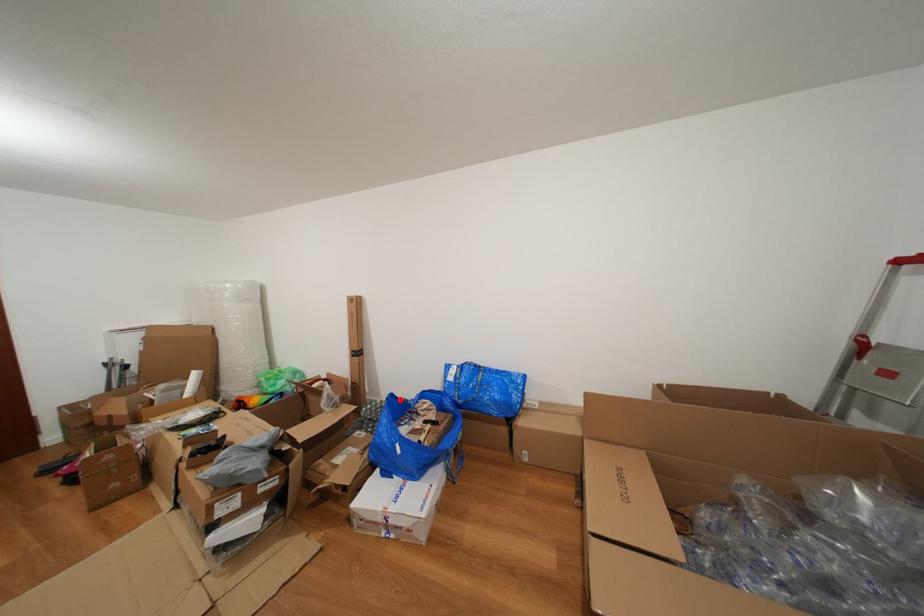
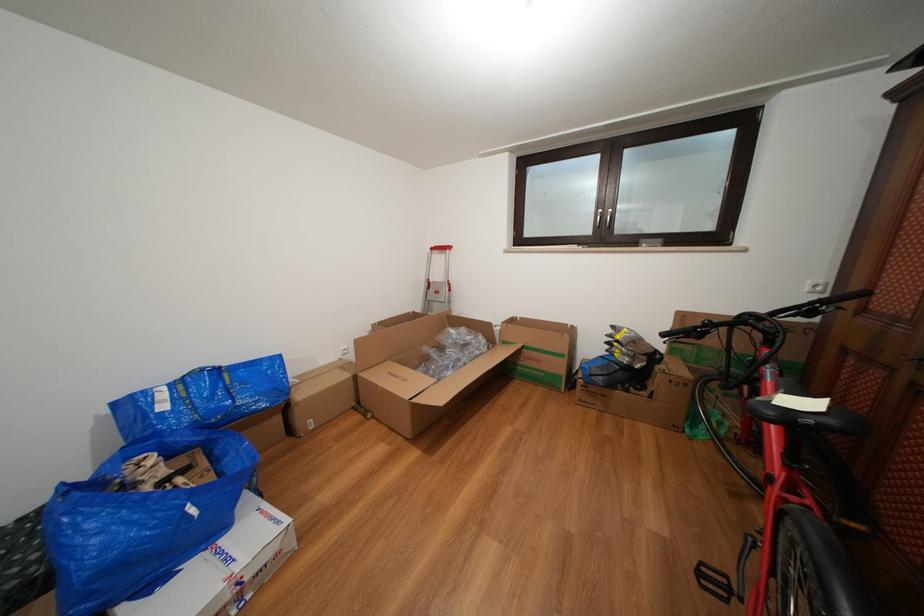
Locate, in the second image, the point that corresponds to the highlighted location in the first image.

(71, 490)